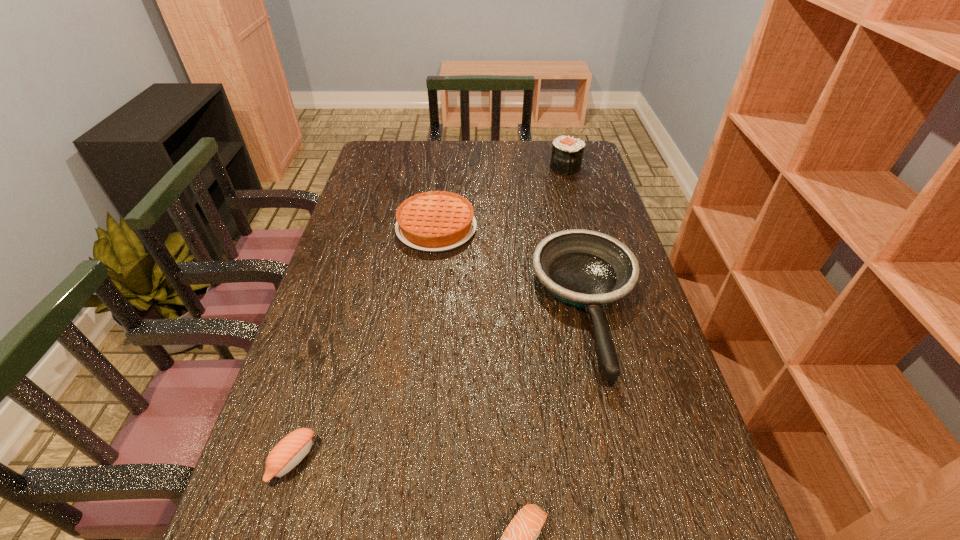
Image resolution: width=960 pixels, height=540 pixels. What are the coordinates of `the farthest sushi` in the screenshot? It's located at coord(567,153).

The image size is (960, 540). Identify the location of the tallest object. (567, 153).

At what (x,y) coordinates should I click in order to perform the action: click on frying pan. Please return your answer as a coordinate pair (x, y). The height and width of the screenshot is (540, 960). Looking at the image, I should click on (588, 269).

At what (x,y) coordinates should I click in order to perform the action: click on pie. Please return your answer as a coordinate pair (x, y). The width and height of the screenshot is (960, 540). Looking at the image, I should click on (434, 221).

I want to click on the second nearest object, so click(289, 452).

At what (x,y) coordinates should I click in order to perform the action: click on the leftmost object. Please return your answer as a coordinate pair (x, y). Looking at the image, I should click on (289, 452).

Identify the location of vacant space located 0.380m on the left of the rightmost sushi. This screenshot has height=540, width=960. (446, 167).

At what (x,y) coordinates should I click in order to perform the action: click on vacant area situated on the handle side of the frying pan. Please return your answer as a coordinate pair (x, y). The width and height of the screenshot is (960, 540). Looking at the image, I should click on pyautogui.click(x=639, y=518).

Find the location of a particular element. vacant position located 0.110m on the front of the pie is located at coordinates (430, 281).

Find the location of a particular element. The image size is (960, 540). free location located on the right of the second nearest sushi is located at coordinates (407, 460).